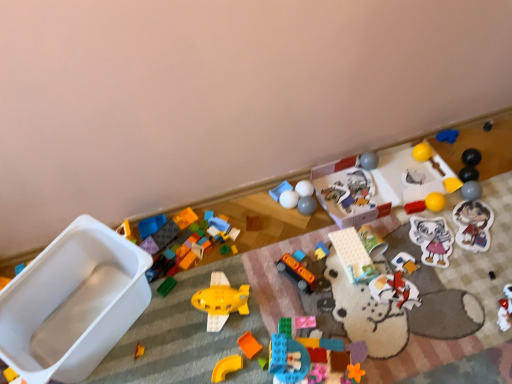
This screenshot has height=384, width=512. What are the coordinates of `free space behind yellow plastic airplane at center, placed as the fourth toy when sorted from left to right` in the screenshot? It's located at (231, 265).